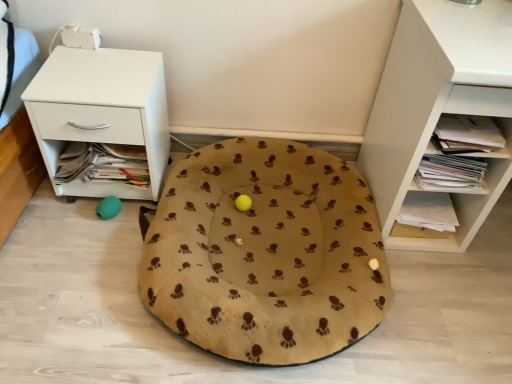
Question: From a real-world perspective, is white glossy nightstand at left located higher than white matte shelf at right?

Choices:
 (A) no
 (B) yes

Answer: (A)

Question: Considering the relative sizes of white glossy nightstand at left and white matte shelf at right in the image provided, is white glossy nightstand at left bigger than white matte shelf at right?

Choices:
 (A) yes
 (B) no

Answer: (B)

Question: Is white glossy nightstand at left taller than white matte shelf at right?

Choices:
 (A) yes
 (B) no

Answer: (B)

Question: From the image's perspective, is white glossy nightstand at left on white matte shelf at right?

Choices:
 (A) no
 (B) yes

Answer: (B)

Question: Could you tell me if white glossy nightstand at left is facing white matte shelf at right?

Choices:
 (A) no
 (B) yes

Answer: (A)

Question: Is white glossy nightstand at left wider or thinner than white matte shelf at right?

Choices:
 (A) thin
 (B) wide

Answer: (A)

Question: Is white glossy nightstand at left taller or shorter than white matte shelf at right?

Choices:
 (A) short
 (B) tall

Answer: (A)

Question: Does point (93, 182) appear closer or farther from the camera than point (482, 56)?

Choices:
 (A) closer
 (B) farther

Answer: (B)

Question: Is white glossy nightstand at left bigger or smaller than white matte shelf at right?

Choices:
 (A) big
 (B) small

Answer: (B)

Question: In terms of height, does white glossy nightstand at left look taller or shorter compared to beige fabric dog bed at center?

Choices:
 (A) short
 (B) tall

Answer: (B)

Question: From the image's perspective, relative to beige fabric dog bed at center, is white glossy nightstand at left above or below?

Choices:
 (A) below
 (B) above

Answer: (B)

Question: Is white glossy nightstand at left to the left or to the right of beige fabric dog bed at center in the image?

Choices:
 (A) left
 (B) right

Answer: (A)

Question: Does point (82, 51) appear closer or farther from the camera than point (280, 185)?

Choices:
 (A) closer
 (B) farther

Answer: (A)

Question: Does point (444, 48) appear closer or farther from the camera than point (365, 274)?

Choices:
 (A) closer
 (B) farther

Answer: (A)

Question: In terms of width, does white matte shelf at right look wider or thinner when compared to beige fabric dog bed at center?

Choices:
 (A) wide
 (B) thin

Answer: (B)